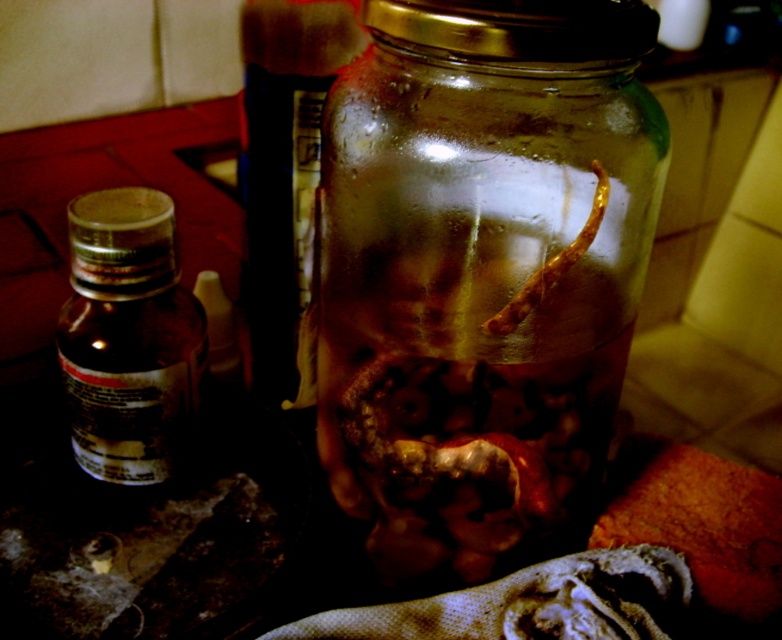
Question: Where is transparent glass jar at center located in relation to brown matte bottle at left in the image?

Choices:
 (A) below
 (B) above

Answer: (B)

Question: Which object is closer to the camera taking this photo?

Choices:
 (A) transparent glass jar at center
 (B) brown matte bottle at left

Answer: (A)

Question: Which of the following is the farthest from the observer?

Choices:
 (A) (345, 426)
 (B) (176, 413)

Answer: (B)

Question: Can you confirm if transparent glass jar at center is positioned to the right of brown matte bottle at left?

Choices:
 (A) yes
 (B) no

Answer: (A)

Question: Does transparent glass jar at center come in front of brown matte bottle at left?

Choices:
 (A) no
 (B) yes

Answer: (B)

Question: Which point is farther to the camera?

Choices:
 (A) (404, 536)
 (B) (81, 278)

Answer: (A)